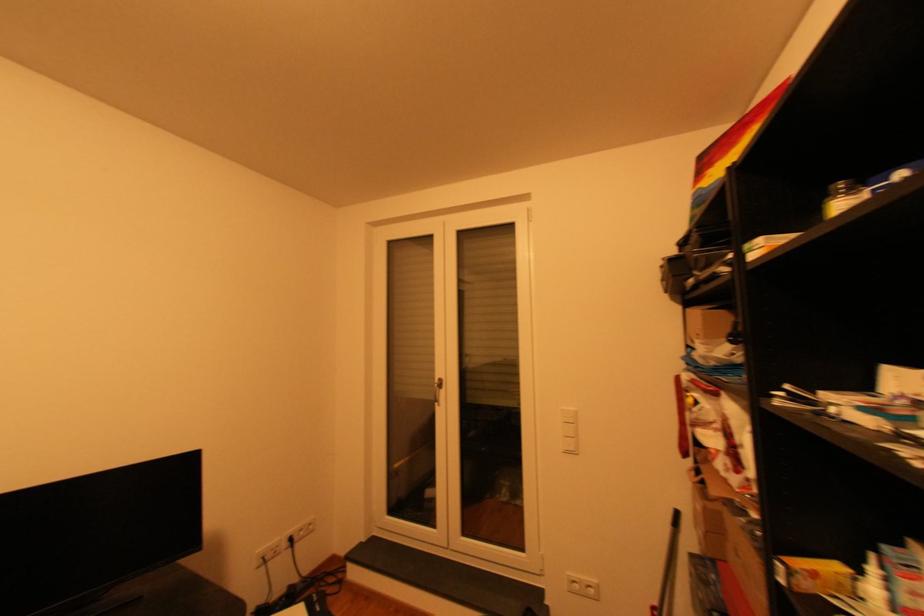
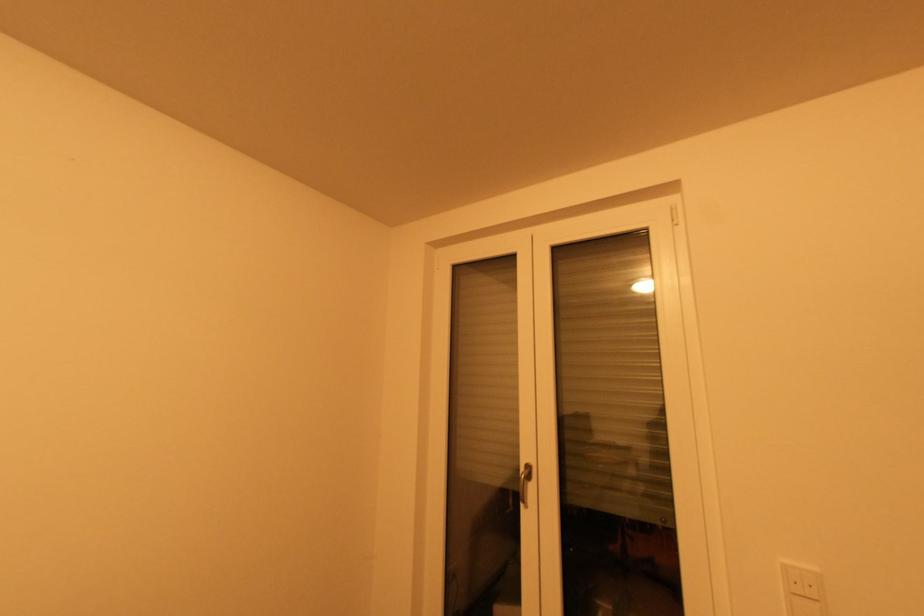
Question: Based on the continuous images, in which direction is the camera rotating? Reply with the corresponding letter.

Choices:
 (A) Left
 (B) Right
 (C) Up
 (D) Down

Answer: (A)